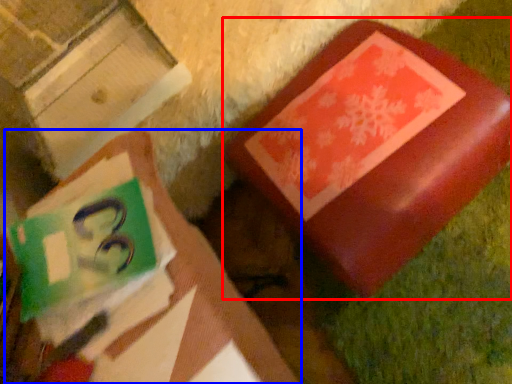
Question: Which object appears closest to the camera in this image, furniture (highlighted by a red box) or book (highlighted by a blue box)?

Choices:
 (A) furniture
 (B) book

Answer: (B)